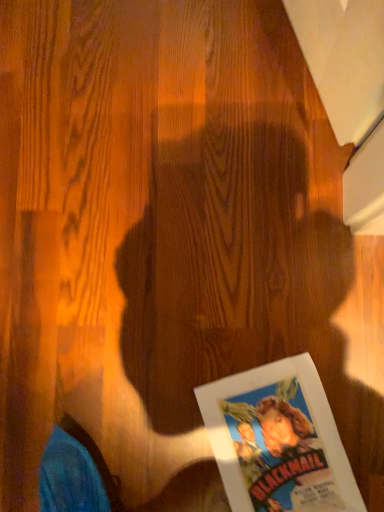
The image size is (384, 512). I want to click on matte paper movie poster at lower right, so click(x=278, y=440).

What do you see at coordinates (278, 440) in the screenshot? I see `matte paper movie poster at lower right` at bounding box center [278, 440].

Locate an element on the screen. The height and width of the screenshot is (512, 384). matte paper movie poster at lower right is located at coordinates (278, 440).